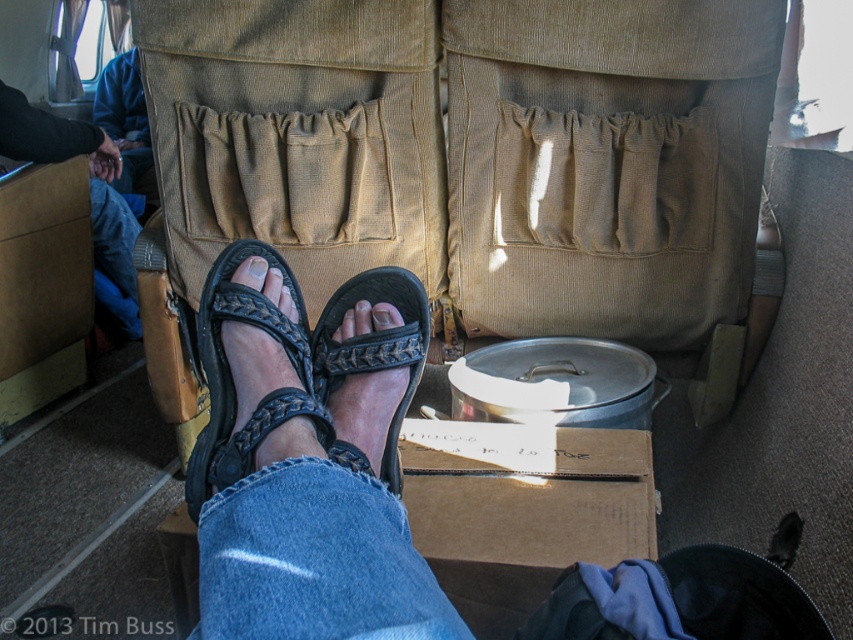
Can you confirm if black woven sandals at center is thinner than brown cardboard box at center?

Yes, black woven sandals at center is thinner than brown cardboard box at center.

The width and height of the screenshot is (853, 640). Describe the element at coordinates (308, 458) in the screenshot. I see `black woven sandals at center` at that location.

Where is `black woven sandals at center`? black woven sandals at center is located at coordinates (308, 458).

Who is higher up, black woven sandal at center or blue denim jeans at upper left?

Positioned higher is blue denim jeans at upper left.

Which is in front, point (408, 314) or point (32, 128)?

Point (408, 314) is in front.

Between point (425, 298) and point (100, 220), which one is positioned in front?

Point (425, 298)

Locate an element on the screen. The width and height of the screenshot is (853, 640). black woven sandal at center is located at coordinates (374, 346).

In the scene shown: Does brown cardboard box at center have a greater width compared to black woven sandal at center?

Yes.

Can you confirm if brown cardboard box at center is taller than black woven sandal at center?

In fact, brown cardboard box at center may be shorter than black woven sandal at center.

The image size is (853, 640). In order to click on brown cardboard box at center in this screenshot , I will do `click(524, 509)`.